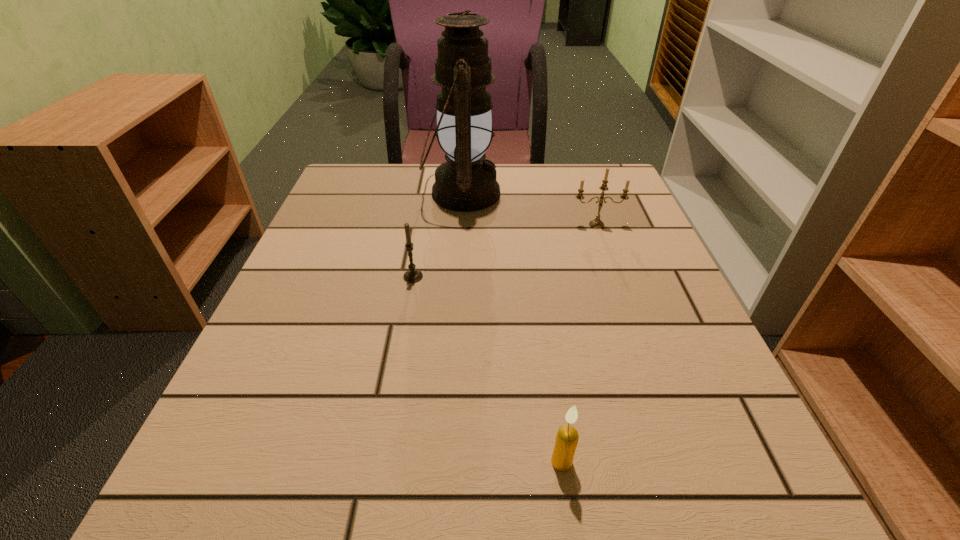
Identify the location of vacant region between the second object from right to left and the third farthest object. (488, 369).

Locate which object is the third closest to the rightmost candle. Please provide its 2D coordinates. Your answer should be formatted as a tuple, i.e. [(x, y)], where the tuple contains the x and y coordinates of a point satisfying the conditions above.

[(567, 436)]

Find the location of a particular element. object that is the third closest to the second candle from right to left is located at coordinates (466, 182).

This screenshot has height=540, width=960. I want to click on candle that is the third closest to the oil lamp, so click(x=567, y=436).

Locate an element on the screen. Image resolution: width=960 pixels, height=540 pixels. candle identified as the closest to the leftmost candle is located at coordinates (596, 223).